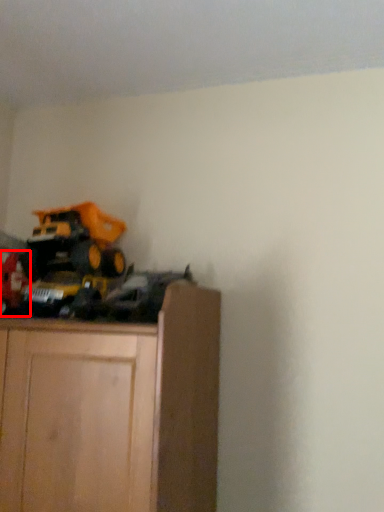
Question: Where is toy (annotated by the red box) located in relation to equipment in the image?

Choices:
 (A) right
 (B) left

Answer: (B)